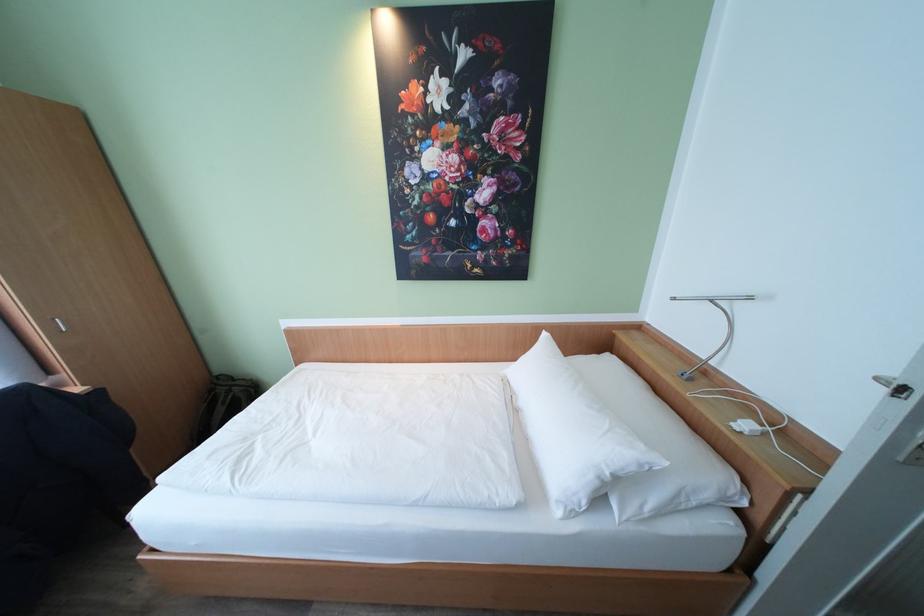
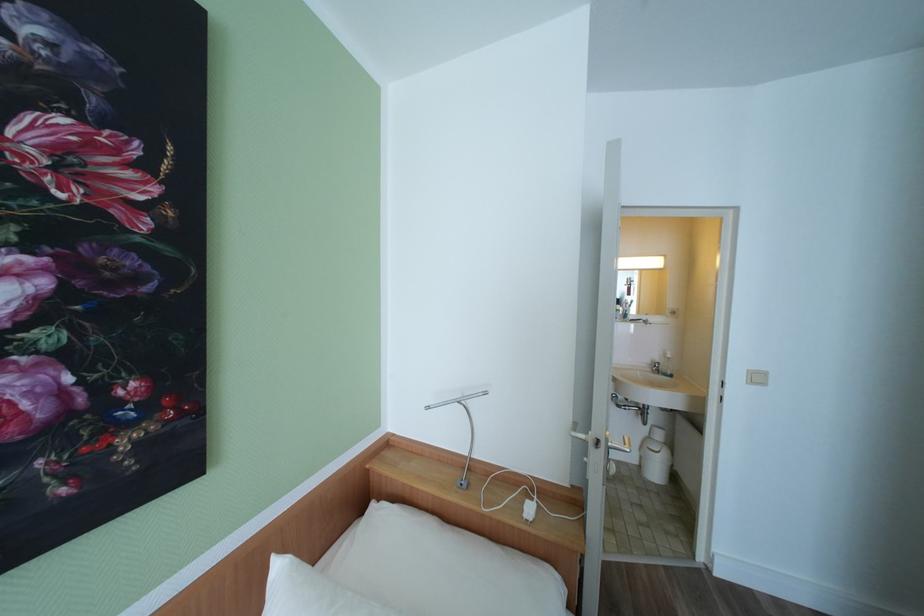
Question: The camera is either moving clockwise (left) or counter-clockwise (right) around the object. The first image is from the beginning of the video and the second image is from the end. Is the camera moving left or right when shooting the video?

Choices:
 (A) Left
 (B) Right

Answer: (A)